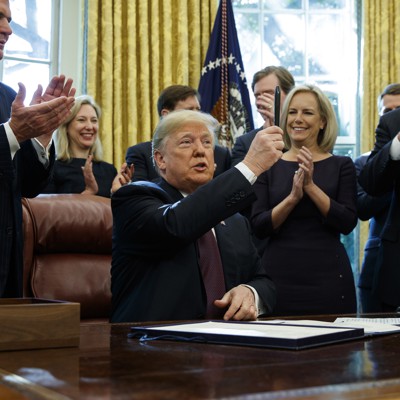
You are a GUI agent. You are given a task and a screenshot of the screen. Output one action in this format:
    pyautogui.click(x=<x>, y=<y>)
    Task: Click on the pen
    This screenshot has height=400, width=400.
    Given the screenshot: What is the action you would take?
    pyautogui.click(x=276, y=104)